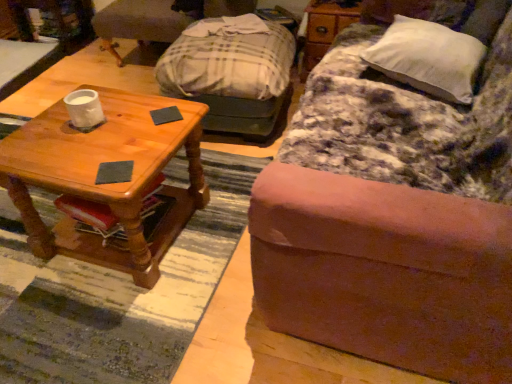
This screenshot has height=384, width=512. I want to click on free space between white marble cup at center left and gray felt coaster at center, marked as the first pad in a front-to-back arrangement, so click(101, 146).